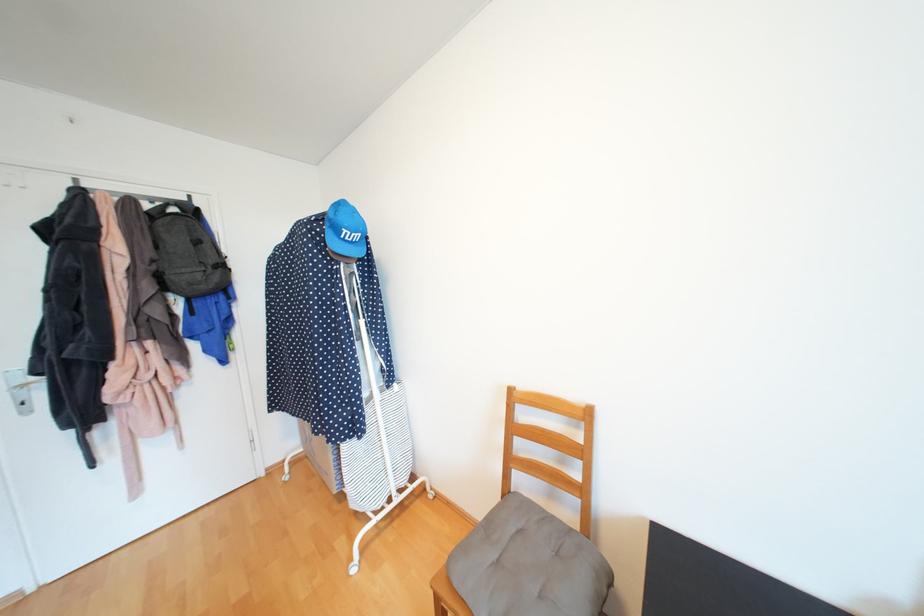
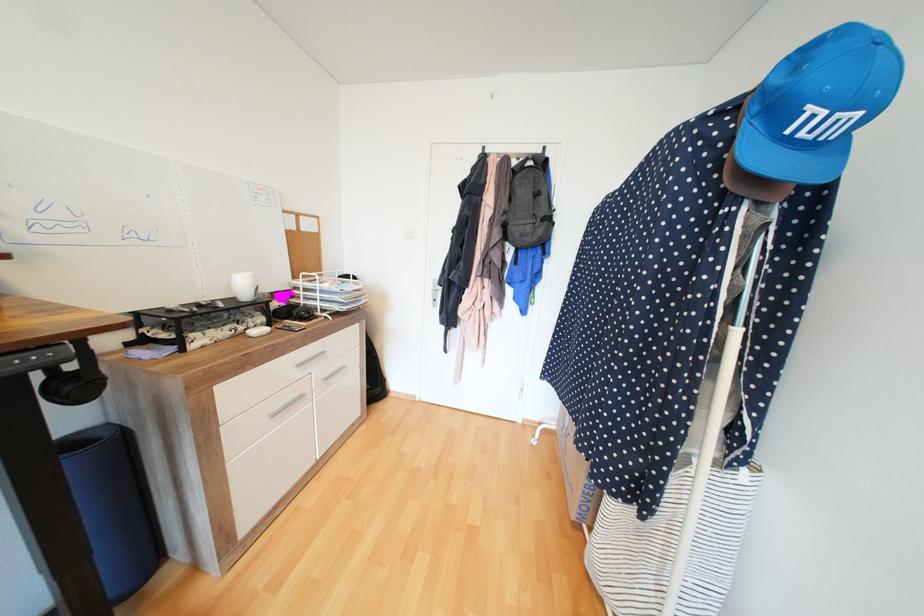
In the second image, find the point that corresponds to pixel 353 238 in the first image.

(807, 134)